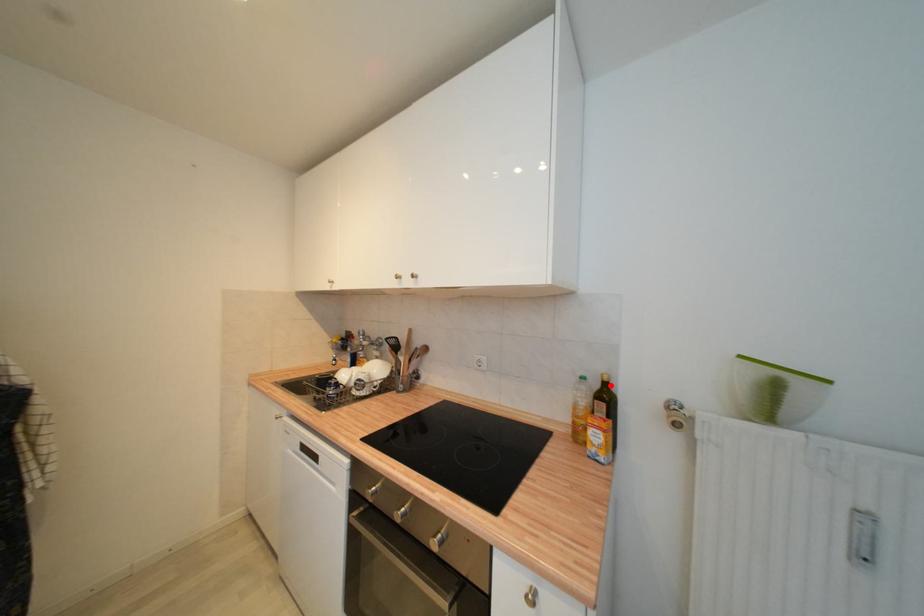
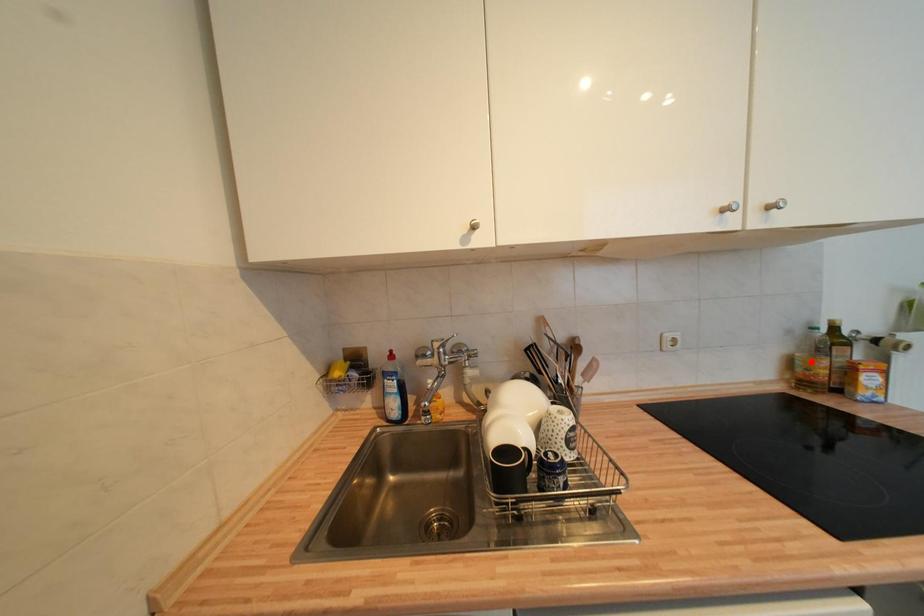
I am providing you with two images of the same scene from different viewpoints. A red point is marked on the first image and another point is marked on the second image. Do the highlighted points in image1 and image2 indicate the same real-world spot?

No